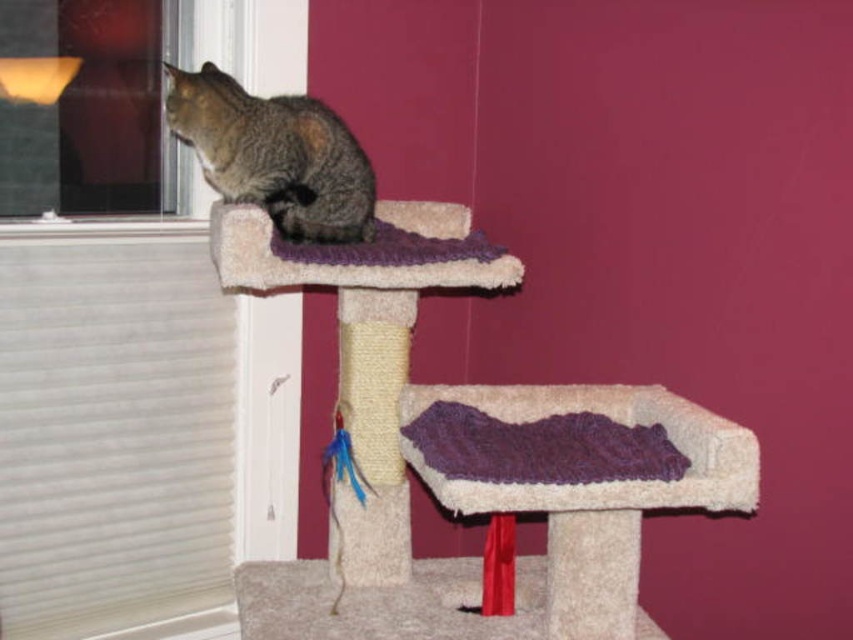
Between beige carpeted stool at center and transparent glass window at upper left, which one has more height?

transparent glass window at upper left is taller.

Is point (601, 484) farther from viewer compared to point (45, 195)?

No, it is in front of (45, 195).

Is point (579, 474) positioned after point (100, 4)?

No.

In order to click on beige carpeted stool at center in this screenshot , I will do `click(576, 476)`.

Which is behind, point (424, 440) or point (345, 234)?

The point (345, 234) is more distant.

Can you confirm if beige carpeted stool at center is wider than tabby fur cat at left?

Correct, the width of beige carpeted stool at center exceeds that of tabby fur cat at left.

Who is more distant from viewer, (428, 480) or (238, 86)?

The point (238, 86) is more distant.

The height and width of the screenshot is (640, 853). Identify the location of beige carpeted stool at center. (576, 476).

Who is higher up, transparent glass window at upper left or tabby fur cat at left?

transparent glass window at upper left is above.

Which is in front, point (25, 161) or point (340, 193)?

Positioned in front is point (340, 193).

Image resolution: width=853 pixels, height=640 pixels. I want to click on transparent glass window at upper left, so click(x=90, y=109).